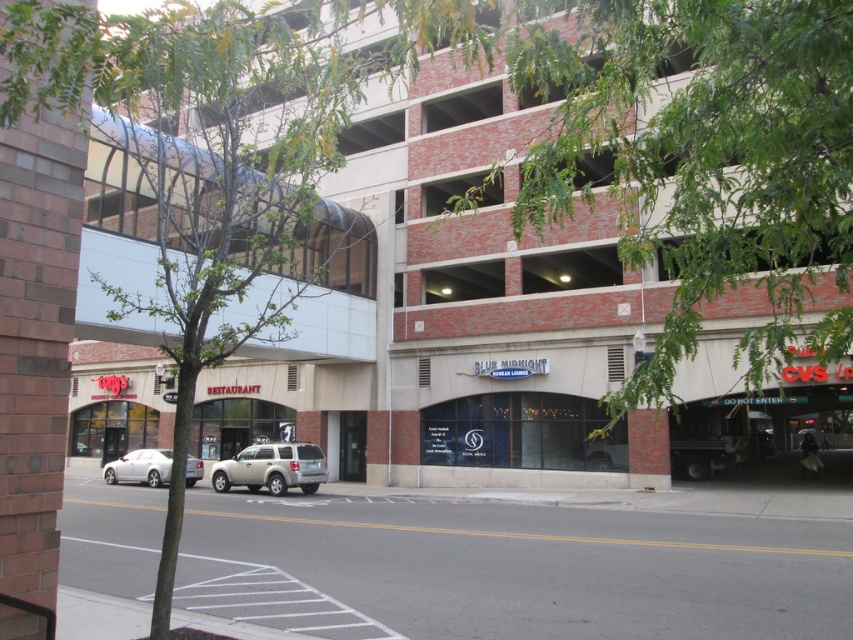
Question: Which object is the closest to the brick wall parking garage at center?

Choices:
 (A) satin silver suv at center
 (B) green leafy tree at upper center
 (C) green leafy tree at center
 (D) silver metallic sedan at lower left

Answer: (B)

Question: Which object is positioned closest to the silver metallic sedan at lower left?

Choices:
 (A) brick wall parking garage at center
 (B) green leafy tree at center
 (C) green leafy tree at upper center
 (D) satin silver suv at center

Answer: (D)

Question: Does brick wall parking garage at center lie in front of green leafy tree at upper center?

Choices:
 (A) yes
 (B) no

Answer: (B)

Question: Which point is farther to the camera?

Choices:
 (A) silver metallic sedan at lower left
 (B) brick wall parking garage at center
 (C) green leafy tree at center
 (D) satin silver suv at center

Answer: (D)

Question: Is satin silver suv at center positioned at the back of silver metallic sedan at lower left?

Choices:
 (A) yes
 (B) no

Answer: (A)

Question: Is green leafy tree at upper center to the left of green leafy tree at center from the viewer's perspective?

Choices:
 (A) no
 (B) yes

Answer: (A)